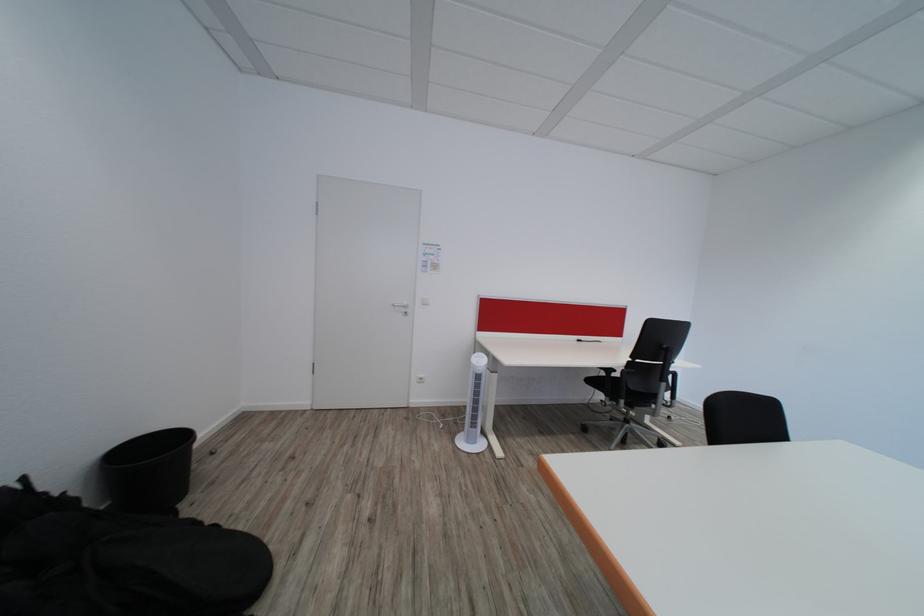
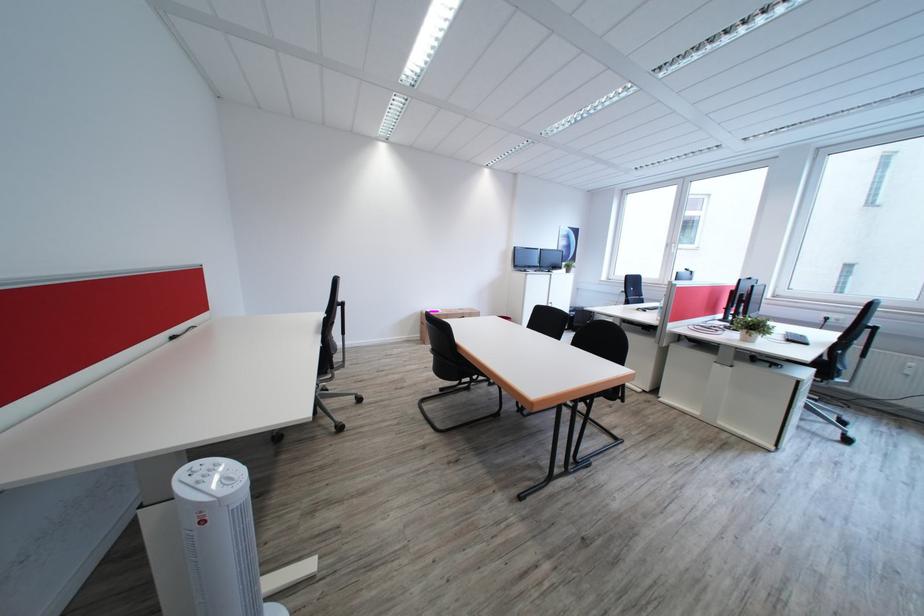
Question: I am providing you with two images of the same scene from different viewpoints. Please identify which objects are invisible in image2.

Choices:
 (A) black chair armrest
 (B) white fan dial
 (C) black roll
 (D) cardboard box

Answer: (A)